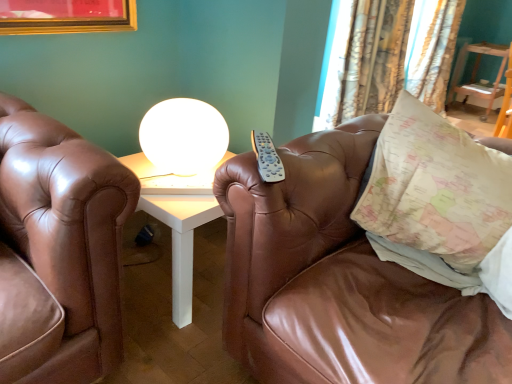
Question: Is patterned fabric curtain at upper right, arranged as the second curtain when viewed from the front, inside map-patterned fabric pillow at right?

Choices:
 (A) yes
 (B) no

Answer: (B)

Question: Does map-patterned fabric pillow at right have a greater height compared to patterned fabric curtain at upper right, which ranks as the first curtain in back-to-front order?

Choices:
 (A) yes
 (B) no

Answer: (B)

Question: Does map-patterned fabric pillow at right have a larger size compared to patterned fabric curtain at upper right, the 2th curtain in the left-to-right sequence?

Choices:
 (A) yes
 (B) no

Answer: (B)

Question: From the image's perspective, is map-patterned fabric pillow at right above patterned fabric curtain at upper right, the 2th curtain in the left-to-right sequence?

Choices:
 (A) no
 (B) yes

Answer: (A)

Question: Can you confirm if map-patterned fabric pillow at right is smaller than patterned fabric curtain at upper right, the 1th curtain in the right-to-left sequence?

Choices:
 (A) no
 (B) yes

Answer: (B)

Question: Is map-patterned fabric pillow at right spatially inside wooden table at upper right, or outside of it?

Choices:
 (A) inside
 (B) outside

Answer: (B)

Question: From a real-world perspective, is map-patterned fabric pillow at right above or below wooden table at upper right?

Choices:
 (A) below
 (B) above

Answer: (B)

Question: In terms of height, does map-patterned fabric pillow at right look taller or shorter compared to wooden table at upper right?

Choices:
 (A) short
 (B) tall

Answer: (A)

Question: Is map-patterned fabric pillow at right bigger or smaller than wooden table at upper right?

Choices:
 (A) big
 (B) small

Answer: (B)

Question: Which is correct: white glossy sphere at upper center is inside wooden table at upper right, or outside of it?

Choices:
 (A) inside
 (B) outside

Answer: (B)

Question: From a real-world perspective, is white glossy sphere at upper center physically located above or below wooden table at upper right?

Choices:
 (A) above
 (B) below

Answer: (A)

Question: Visually, is white glossy sphere at upper center positioned to the left or to the right of wooden table at upper right?

Choices:
 (A) right
 (B) left

Answer: (B)

Question: Is point (219, 120) closer or farther from the camera than point (459, 49)?

Choices:
 (A) closer
 (B) farther

Answer: (A)

Question: From a real-world perspective, is brown leather couch at center physically located above or below patterned fabric curtain at upper right, which is the 1th curtain from left to right?

Choices:
 (A) above
 (B) below

Answer: (B)

Question: Looking at their shapes, would you say brown leather couch at center is wider or thinner than patterned fabric curtain at upper right, placed as the 1th curtain when sorted from front to back?

Choices:
 (A) wide
 (B) thin

Answer: (A)